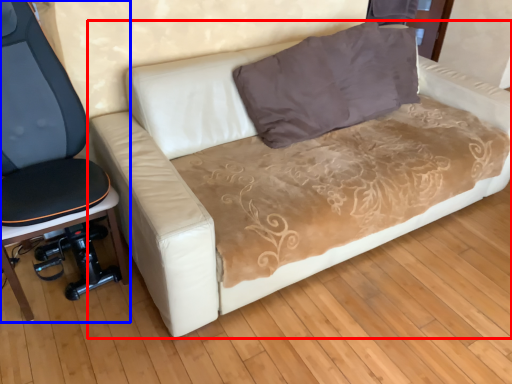
Question: Which point is further to the camera, studio couch (highlighted by a red box) or furniture (highlighted by a blue box)?

Choices:
 (A) studio couch
 (B) furniture

Answer: (B)